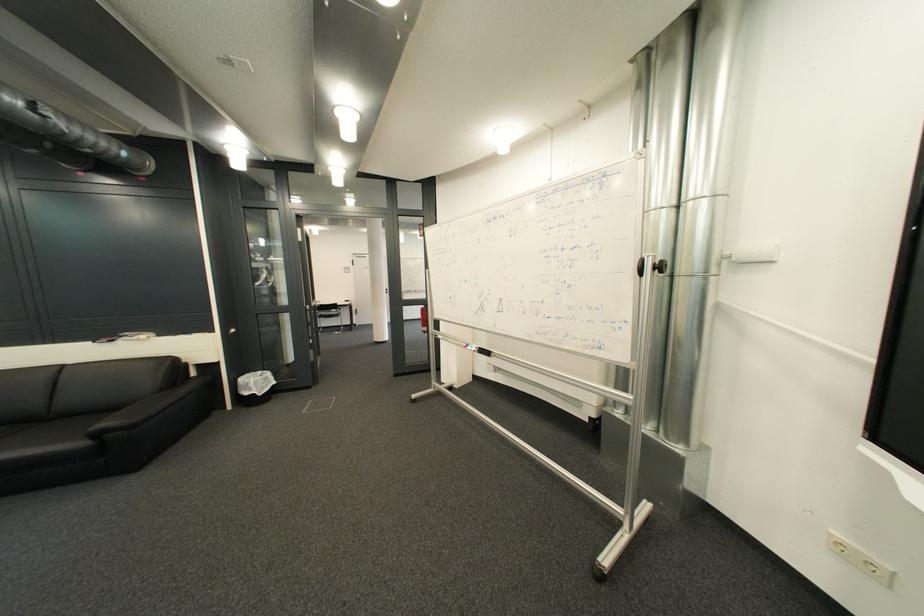
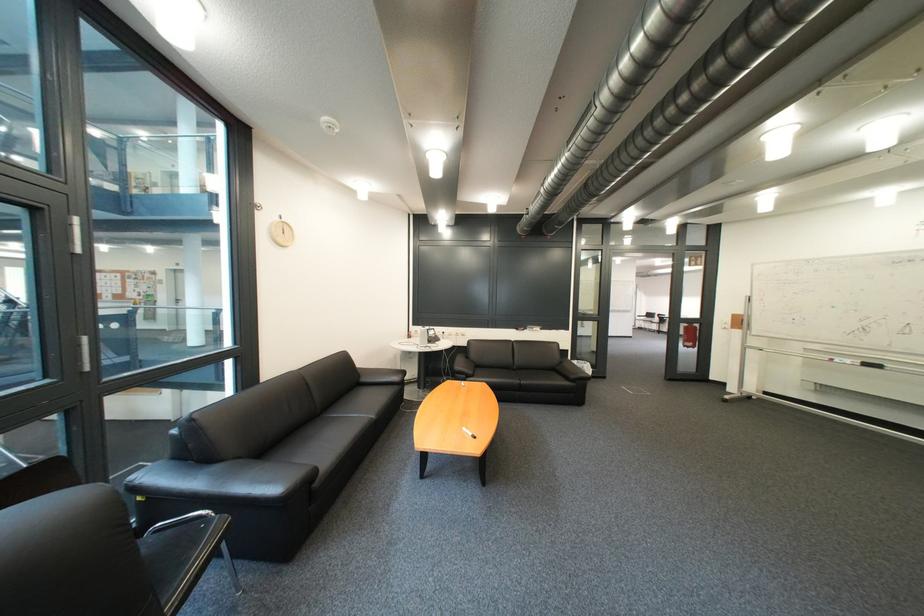
Find the pixel in the second image that matches the point at 322,389 in the first image.

(618, 379)